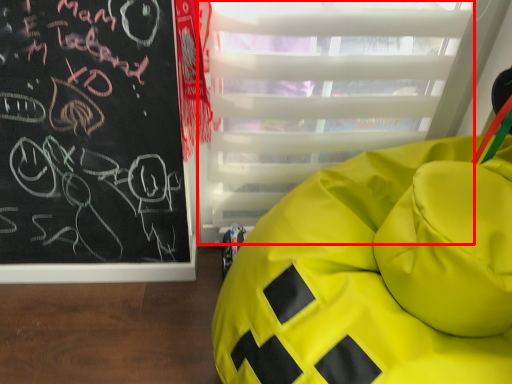
Question: Observing the image, what is the correct spatial positioning of glass door (annotated by the red box) in reference to furniture?

Choices:
 (A) right
 (B) left

Answer: (B)